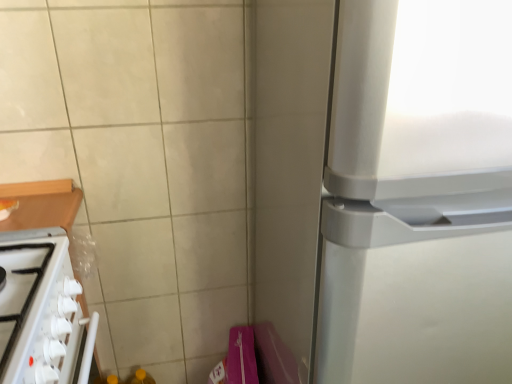
This screenshot has width=512, height=384. Identify the location of white glossy stove at lower left. (42, 311).

Describe the element at coordinates (42, 311) in the screenshot. I see `white glossy stove at lower left` at that location.

What is the approximate width of white glossy stove at lower left?

white glossy stove at lower left is 9.47 inches in width.

Describe the element at coordinates (419, 195) in the screenshot. The width and height of the screenshot is (512, 384). I see `satin silver refrigerator at right` at that location.

The width and height of the screenshot is (512, 384). I want to click on satin silver refrigerator at right, so click(x=419, y=195).

Image resolution: width=512 pixels, height=384 pixels. I want to click on white glossy stove at lower left, so click(x=42, y=311).

Which object is positioned more to the right, white glossy stove at lower left or satin silver refrigerator at right?

Positioned to the right is satin silver refrigerator at right.

Considering the positions of objects white glossy stove at lower left and satin silver refrigerator at right in the image provided, who is behind, white glossy stove at lower left or satin silver refrigerator at right?

white glossy stove at lower left is behind.

Is point (78, 358) closer or farther from the camera than point (416, 334)?

Clearly, point (78, 358) is more distant from the camera than point (416, 334).

From the image's perspective, is white glossy stove at lower left positioned above or below satin silver refrigerator at right?

From the image's perspective, white glossy stove at lower left appears below satin silver refrigerator at right.

From a real-world perspective, is white glossy stove at lower left physically below satin silver refrigerator at right?

Yes, from a real-world perspective, white glossy stove at lower left is under satin silver refrigerator at right.

Between white glossy stove at lower left and satin silver refrigerator at right, which one has larger width?

satin silver refrigerator at right.

Which of these two, white glossy stove at lower left or satin silver refrigerator at right, stands taller?

Standing taller between the two is satin silver refrigerator at right.

Considering the relative sizes of white glossy stove at lower left and satin silver refrigerator at right in the image provided, is white glossy stove at lower left bigger than satin silver refrigerator at right?

No.

Does white glossy stove at lower left contain satin silver refrigerator at right?

No, white glossy stove at lower left does not contain satin silver refrigerator at right.

Is white glossy stove at lower left in contact with satin silver refrigerator at right?

No, white glossy stove at lower left is not next to satin silver refrigerator at right.

Is white glossy stove at lower left oriented away from satin silver refrigerator at right?

No, satin silver refrigerator at right is not at the back of white glossy stove at lower left.

Consider the image. How many degrees apart are the facing directions of white glossy stove at lower left and satin silver refrigerator at right?

The angular difference between white glossy stove at lower left and satin silver refrigerator at right is 90.3 degrees.

Locate an element on the screen. The height and width of the screenshot is (384, 512). refrigerator above the white glossy stove at lower left (from the image's perspective) is located at coordinates (419, 195).

Would you say satin silver refrigerator at right is to the left or to the right of white glossy stove at lower left in the picture?

Based on their positions, satin silver refrigerator at right is located to the right of white glossy stove at lower left.

Which object is further away from the camera taking this photo, satin silver refrigerator at right or white glossy stove at lower left?

Positioned behind is white glossy stove at lower left.

Does point (337, 144) lie behind point (60, 333)?

No, it is in front of (60, 333).

Looking at this image, from the image's perspective, who appears lower, satin silver refrigerator at right or white glossy stove at lower left?

white glossy stove at lower left.

From a real-world perspective, is satin silver refrigerator at right located beneath white glossy stove at lower left?

Actually, satin silver refrigerator at right is physically above white glossy stove at lower left in the real world.

Is satin silver refrigerator at right wider than white glossy stove at lower left?

Yes.

Considering the sizes of objects satin silver refrigerator at right and white glossy stove at lower left in the image provided, who is taller, satin silver refrigerator at right or white glossy stove at lower left?

Standing taller between the two is satin silver refrigerator at right.

Can you confirm if satin silver refrigerator at right is bigger than white glossy stove at lower left?

Yes.

Can white glossy stove at lower left be found inside satin silver refrigerator at right?

Definitely not — white glossy stove at lower left is not inside satin silver refrigerator at right.

Is satin silver refrigerator at right touching white glossy stove at lower left?

No, satin silver refrigerator at right is not in contact with white glossy stove at lower left.

Is satin silver refrigerator at right facing towards white glossy stove at lower left?

No, satin silver refrigerator at right is not facing towards white glossy stove at lower left.

How different are the orientations of satin silver refrigerator at right and white glossy stove at lower left in degrees?

90.3 degrees separate the facing orientations of satin silver refrigerator at right and white glossy stove at lower left.

Image resolution: width=512 pixels, height=384 pixels. I want to click on home appliance below the satin silver refrigerator at right (from the image's perspective), so click(x=42, y=311).

The width and height of the screenshot is (512, 384). Identify the location of home appliance on the left side of satin silver refrigerator at right. (42, 311).

Identify the location of home appliance behind the satin silver refrigerator at right. (42, 311).